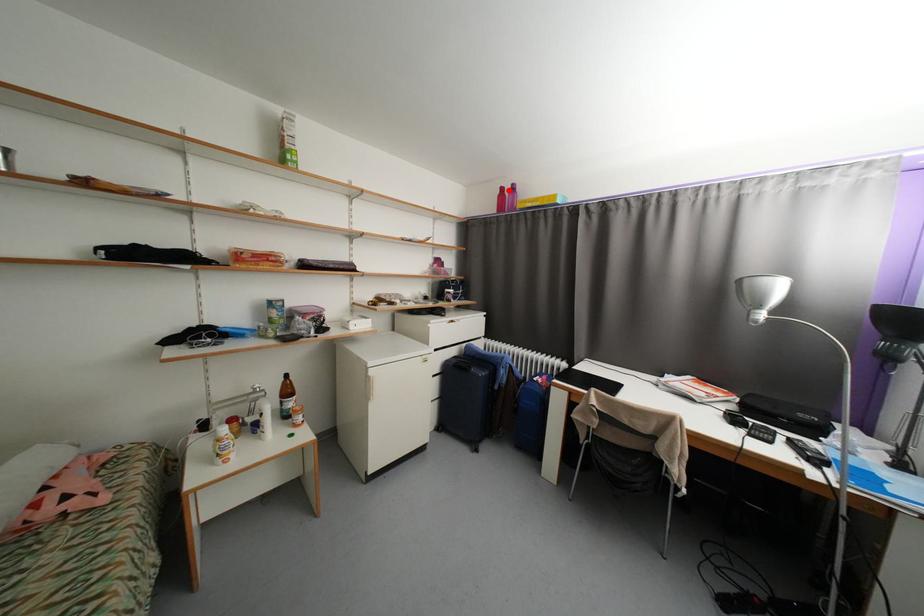
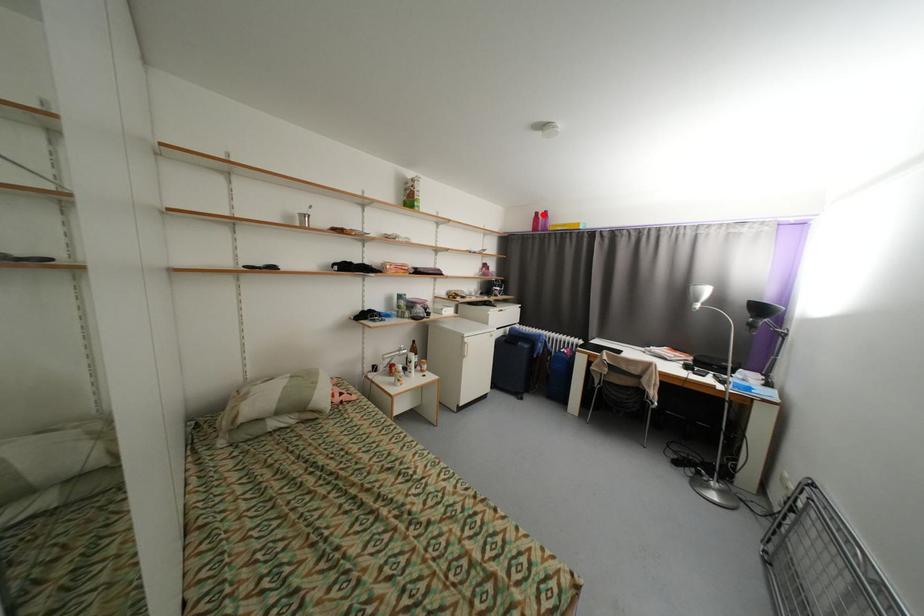
I am providing you with two images of the same scene from different viewpoints. A red point is marked on the first image and another point is marked on the second image. Do the highlighted points in image1 and image2 indicate the same real-world spot?

Yes